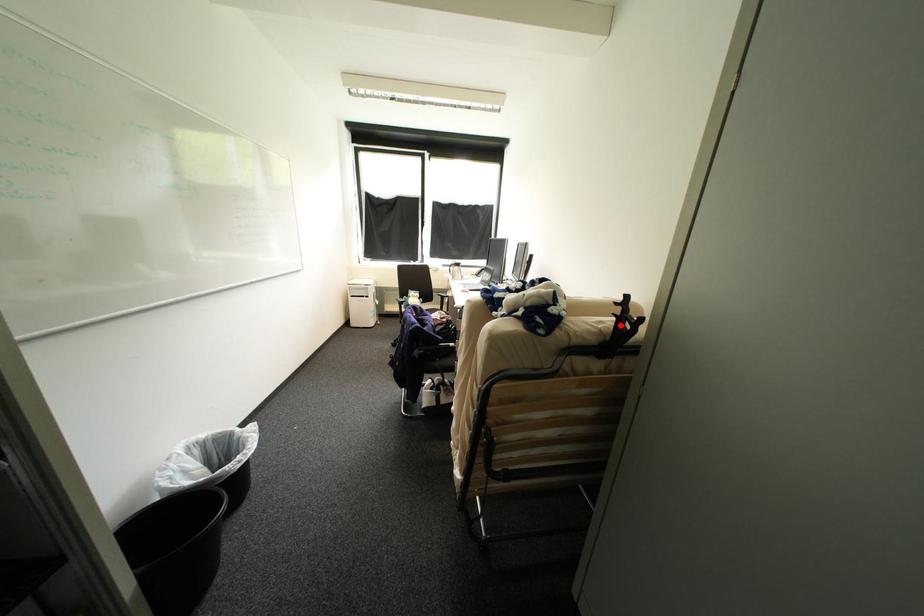
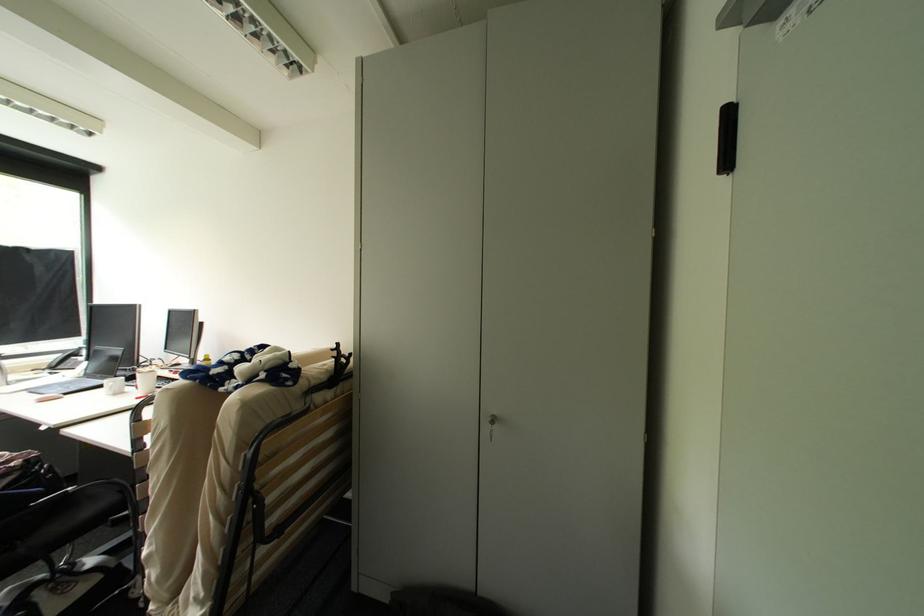
Locate, in the second image, the point that corresponds to the highlighted location in the first image.

(341, 363)